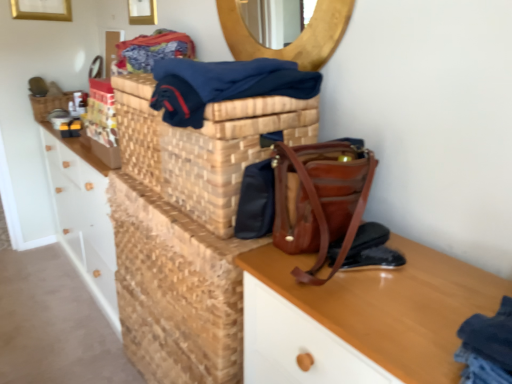
The width and height of the screenshot is (512, 384). What are the coordinates of `vacant space situated on the left part of black leather shoe at lower right, the 2th shoe viewed from the top` in the screenshot? It's located at pyautogui.click(x=300, y=273).